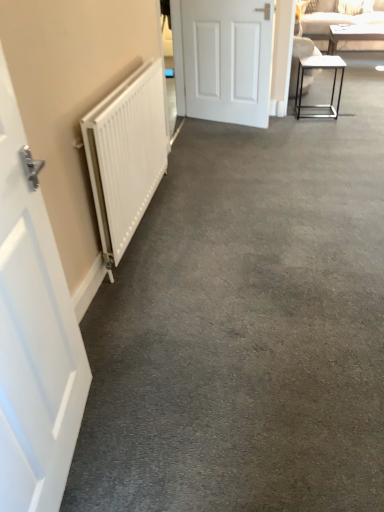
The image size is (384, 512). What do you see at coordinates (332, 88) in the screenshot? I see `metallic frame table at right, the first table viewed from the left` at bounding box center [332, 88].

In order to face metallic frame table at right, which appears as the 2th table when viewed from the top, should I rotate leftwards or rightwards?

Rotate right and turn 16.786 degrees.

Locate an element on the screen. The height and width of the screenshot is (512, 384). white glossy table at upper right, which is counted as the first table, starting from the top is located at coordinates (353, 34).

Describe the element at coordinates (126, 156) in the screenshot. I see `white matte radiator at left` at that location.

Identify the location of beige fabric couch at upper right. (335, 20).

Is white matte door at left, which is the second door in right-to-left order, at the left side of metallic frame table at right, the second table viewed from the right?

Indeed, white matte door at left, which is the second door in right-to-left order, is positioned on the left side of metallic frame table at right, the second table viewed from the right.

Between white matte door at left, the first door from the front, and metallic frame table at right, which appears as the 2th table when viewed from the top, which one is positioned in front?

Positioned in front is white matte door at left, the first door from the front.

Starting from the white matte door at left, the first door from the front, which table is the 1st one behind? Please provide its 2D coordinates.

[(332, 88)]

Does white matte door at left, which is counted as the first door, starting from the left, have a larger size compared to metallic frame table at right, which appears as the 2th table when viewed from the top?

Indeed, white matte door at left, which is counted as the first door, starting from the left, has a larger size compared to metallic frame table at right, which appears as the 2th table when viewed from the top.

You are a GUI agent. You are given a task and a screenshot of the screen. Output one action in this format:
    pyautogui.click(x=<x>, y=<y>)
    Task: Click on the door that appears in front of the white matte radiator at left
    This screenshot has width=384, height=512.
    Given the screenshot: What is the action you would take?
    pyautogui.click(x=33, y=335)

Is point (134, 152) closer or farther from the camera than point (71, 361)?

Point (134, 152).

From the image's perspective, is white matte radiator at left located beneath white matte door at left, the first door from the front?

No.

From the image's perspective, is white glossy table at upper right, the 1th table when ordered from back to front, over white matte door at left, the 2th door when ordered from top to bottom?

Yes.

From their relative heights in the image, would you say white glossy table at upper right, marked as the 1th table in a right-to-left arrangement, is taller or shorter than white matte door at left, which is counted as the first door, starting from the left?

Considering their sizes, white glossy table at upper right, marked as the 1th table in a right-to-left arrangement, has less height than white matte door at left, which is counted as the first door, starting from the left.

Is white glossy table at upper right, marked as the 1th table in a right-to-left arrangement, outside of white matte door at left, the first door from the front?

That's correct, white glossy table at upper right, marked as the 1th table in a right-to-left arrangement, is outside of white matte door at left, the first door from the front.

Which is more to the left, white glossy table at upper right, the 2th table positioned from the front, or white matte door at left, which is the 2th door in back-to-front order?

white matte door at left, which is the 2th door in back-to-front order, is more to the left.

Considering the relative positions of white matte door at left, which is the 2th door in back-to-front order, and beige fabric couch at upper right in the image provided, is white matte door at left, which is the 2th door in back-to-front order, in front of beige fabric couch at upper right?

Yes, white matte door at left, which is the 2th door in back-to-front order, is closer to the viewer.

Measure the distance between white matte door at left, the 2th door when ordered from top to bottom, and beige fabric couch at upper right.

white matte door at left, the 2th door when ordered from top to bottom, and beige fabric couch at upper right are 5.13 meters apart from each other.

Considering the positions of points (11, 434) and (313, 16), is point (11, 434) farther from camera compared to point (313, 16)?

No, it is not.

Does white matte door at left, the first door from the front, have a greater width compared to beige fabric couch at upper right?

In fact, white matte door at left, the first door from the front, might be narrower than beige fabric couch at upper right.

Who is bigger, white matte door at left, the 2th door when ordered from top to bottom, or white matte radiator at left?

With larger size is white matte radiator at left.

From the image's perspective, is white matte door at left, the 2th door when ordered from top to bottom, beneath white matte radiator at left?

Indeed, from the image's perspective, white matte door at left, the 2th door when ordered from top to bottom, is shown beneath white matte radiator at left.

How much distance is there between white matte door at left, which is counted as the first door, starting from the left, and white matte radiator at left?

36.64 inches.

Would you say white matte door at left, which is the 2th door in back-to-front order, is outside white matte radiator at left?

Yes, white matte door at left, which is the 2th door in back-to-front order, is outside of white matte radiator at left.

From a real-world perspective, is metallic frame table at right, acting as the 1th table starting from the front, physically located above or below beige fabric couch at upper right?

Clearly, from a real-world perspective, metallic frame table at right, acting as the 1th table starting from the front, is below beige fabric couch at upper right.

Are metallic frame table at right, marked as the 2th table in a back-to-front arrangement, and beige fabric couch at upper right far apart?

That's right, there is a large distance between metallic frame table at right, marked as the 2th table in a back-to-front arrangement, and beige fabric couch at upper right.

Considering the positions of points (320, 105) and (335, 10), is point (320, 105) closer to camera compared to point (335, 10)?

Yes, point (320, 105) is closer to viewer.

Can beige fabric couch at upper right be found inside white matte door at center, the 2th door in the front-to-back sequence?

No, beige fabric couch at upper right is not surrounded by white matte door at center, the 2th door in the front-to-back sequence.

Considering the sizes of objects white matte door at center, placed as the second door when sorted from bottom to top, and beige fabric couch at upper right in the image provided, who is thinner, white matte door at center, placed as the second door when sorted from bottom to top, or beige fabric couch at upper right?

With smaller width is white matte door at center, placed as the second door when sorted from bottom to top.

From the image's perspective, which is above, white matte door at center, acting as the 1th door starting from the right, or beige fabric couch at upper right?

beige fabric couch at upper right appears higher in the image.

Where is `the 2nd door directly above the metallic frame table at right, which appears as the 2th table when viewed from the top (from a real-world perspective)`? The image size is (384, 512). the 2nd door directly above the metallic frame table at right, which appears as the 2th table when viewed from the top (from a real-world perspective) is located at coordinates (33, 335).

Locate an element on the screen. door below the white matte radiator at left (from the image's perspective) is located at coordinates (33, 335).

From the image, which object appears to be farther from white matte door at center, acting as the 1th door starting from the right, white glossy table at upper right, which appears as the second table when viewed from the left, or beige fabric couch at upper right?

white glossy table at upper right, which appears as the second table when viewed from the left.

From the image, which object appears to be nearer to metallic frame table at right, acting as the 1th table starting from the front, white matte radiator at left or white glossy table at upper right, which appears as the second table when viewed from the left?

Among the two, white glossy table at upper right, which appears as the second table when viewed from the left, is located nearer to metallic frame table at right, acting as the 1th table starting from the front.

Looking at the image, which one is located closer to white matte door at center, the first door positioned from the top, white matte door at left, which is the second door in right-to-left order, or metallic frame table at right, arranged as the first table when ordered from the bottom?

metallic frame table at right, arranged as the first table when ordered from the bottom, is closer to white matte door at center, the first door positioned from the top.

Looking at the image, which one is located closer to metallic frame table at right, marked as the 2th table in a back-to-front arrangement, white matte door at left, the 2th door when ordered from top to bottom, or white matte door at center, which appears as the second door when viewed from the left?

white matte door at center, which appears as the second door when viewed from the left, is positioned closer to the anchor metallic frame table at right, marked as the 2th table in a back-to-front arrangement.

Looking at the image, which one is located further to white matte radiator at left, metallic frame table at right, marked as the 2th table in a back-to-front arrangement, or white matte door at left, the first door from the front?

Based on the image, metallic frame table at right, marked as the 2th table in a back-to-front arrangement, appears to be further to white matte radiator at left.

Based on their spatial positions, is beige fabric couch at upper right or metallic frame table at right, the first table viewed from the left, further from white glossy table at upper right, which is the 2th table from bottom to top?

Among the two, metallic frame table at right, the first table viewed from the left, is located further to white glossy table at upper right, which is the 2th table from bottom to top.

Looking at the image, which one is located further to white matte door at center, placed as the second door when sorted from bottom to top, metallic frame table at right, the first table viewed from the left, or white matte radiator at left?

Based on the image, white matte radiator at left appears to be further to white matte door at center, placed as the second door when sorted from bottom to top.

From the image, which object appears to be nearer to white matte radiator at left, white matte door at left, the 2th door when ordered from top to bottom, or white matte door at center, the 2th door in the front-to-back sequence?

white matte door at left, the 2th door when ordered from top to bottom, is positioned closer to the anchor white matte radiator at left.

This screenshot has width=384, height=512. Identify the location of radiator between white matte door at left, positioned as the 1th door in bottom-to-top order, and white glossy table at upper right, the 1th table when ordered from back to front, in the front-back direction. (126, 156).

Locate an element on the screen. Image resolution: width=384 pixels, height=512 pixels. door between beige fabric couch at upper right and metallic frame table at right, the first table viewed from the left, from top to bottom is located at coordinates (223, 59).

I want to click on radiator between white matte door at left, which is the second door in right-to-left order, and white matte door at center, acting as the 1th door starting from the right, along the z-axis, so click(126, 156).

Where is `table located between white matte radiator at left and beige fabric couch at upper right in the depth direction`? The width and height of the screenshot is (384, 512). table located between white matte radiator at left and beige fabric couch at upper right in the depth direction is located at coordinates (332, 88).